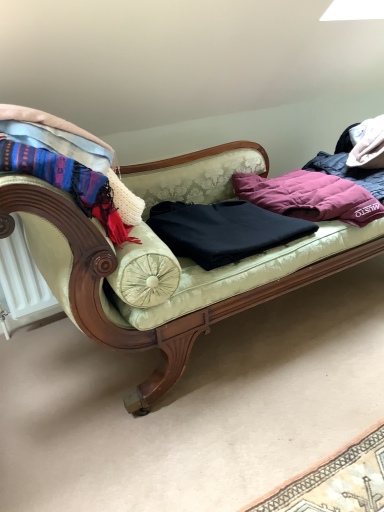
Question: Is velvet green couch at center facing towards black matte sweater at center, the first clothing positioned from the left?

Choices:
 (A) yes
 (B) no

Answer: (A)

Question: From the image's perspective, would you say velvet green couch at center is shown under black matte sweater at center, placed as the second clothing when sorted from right to left?

Choices:
 (A) no
 (B) yes

Answer: (A)

Question: Considering the relative sizes of velvet green couch at center and black matte sweater at center, the first clothing positioned from the left, in the image provided, is velvet green couch at center shorter than black matte sweater at center, the first clothing positioned from the left,?

Choices:
 (A) no
 (B) yes

Answer: (A)

Question: Does velvet green couch at center appear on the left side of black matte sweater at center, the first clothing positioned from the left?

Choices:
 (A) yes
 (B) no

Answer: (B)

Question: Does velvet green couch at center have a greater width compared to black matte sweater at center, the first clothing positioned from the left?

Choices:
 (A) no
 (B) yes

Answer: (B)

Question: From the image's perspective, is purple down jacket at center, marked as the 2th clothing in a left-to-right arrangement, positioned above or below black matte sweater at center, the first clothing positioned from the left?

Choices:
 (A) above
 (B) below

Answer: (A)

Question: Considering the positions of purple down jacket at center, marked as the 2th clothing in a left-to-right arrangement, and black matte sweater at center, the first clothing positioned from the left, in the image, is purple down jacket at center, marked as the 2th clothing in a left-to-right arrangement, bigger or smaller than black matte sweater at center, the first clothing positioned from the left,?

Choices:
 (A) big
 (B) small

Answer: (A)

Question: Is purple down jacket at center, marked as the 2th clothing in a left-to-right arrangement, in front of or behind black matte sweater at center, placed as the second clothing when sorted from right to left, in the image?

Choices:
 (A) front
 (B) behind

Answer: (B)

Question: Considering the positions of purple down jacket at center, marked as the 2th clothing in a left-to-right arrangement, and black matte sweater at center, the first clothing positioned from the left, in the image, is purple down jacket at center, marked as the 2th clothing in a left-to-right arrangement, wider or thinner than black matte sweater at center, the first clothing positioned from the left,?

Choices:
 (A) wide
 (B) thin

Answer: (A)

Question: Is knitted wool scarf at left in front of or behind black matte sweater at center, placed as the second clothing when sorted from right to left, in the image?

Choices:
 (A) behind
 (B) front

Answer: (B)

Question: From the image's perspective, relative to black matte sweater at center, the first clothing positioned from the left, is knitted wool scarf at left above or below?

Choices:
 (A) above
 (B) below

Answer: (A)

Question: In terms of height, does knitted wool scarf at left look taller or shorter compared to black matte sweater at center, placed as the second clothing when sorted from right to left?

Choices:
 (A) short
 (B) tall

Answer: (B)

Question: Looking at the image, does knitted wool scarf at left seem bigger or smaller compared to black matte sweater at center, the first clothing positioned from the left?

Choices:
 (A) small
 (B) big

Answer: (A)

Question: Is purple down jacket at center, marked as the 2th clothing in a left-to-right arrangement, wider or thinner than knitted wool scarf at left?

Choices:
 (A) wide
 (B) thin

Answer: (A)

Question: Visually, is purple down jacket at center, positioned as the 1th clothing in right-to-left order, positioned to the left or to the right of knitted wool scarf at left?

Choices:
 (A) right
 (B) left

Answer: (A)